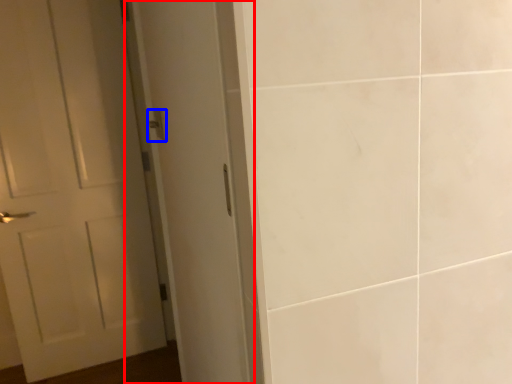
Question: Which object is closer to the camera taking this photo, screen door (highlighted by a red box) or door handle (highlighted by a blue box)?

Choices:
 (A) screen door
 (B) door handle

Answer: (B)